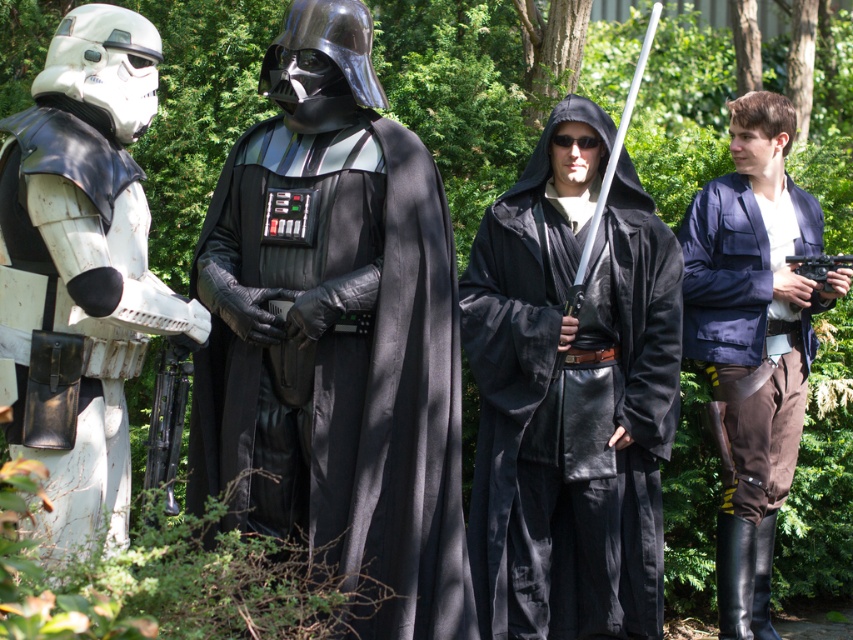
You are a costume designer trying to create a replica of the black leather cape at center and the navy blue fabric jacket at right. Based on the scene, which of these two items requires more fabric to make?

The black leather cape at center requires more fabric than the navy blue fabric jacket at right since it has a larger size according to the description.

You are a photographer trying to capture a clear shot of both the white matte armor at left and the navy blue fabric jacket at right. Which object should you focus on first to ensure both are in focus?

The white matte armor at left is closer to the viewer than the navy blue fabric jacket at right. To ensure both are in focus, focus on the white matte armor at left first since it is closer, and the depth of field will naturally include the navy blue fabric jacket at right in the background.

You are a photographer trying to capture a group photo of the white matte armor at left and the navy blue fabric jacket at right. If you want to ensure both subjects fit in the frame without cropping, which subject requires more space horizontally?

The navy blue fabric jacket at right requires more horizontal space because its width is greater than the white matte armor at left.